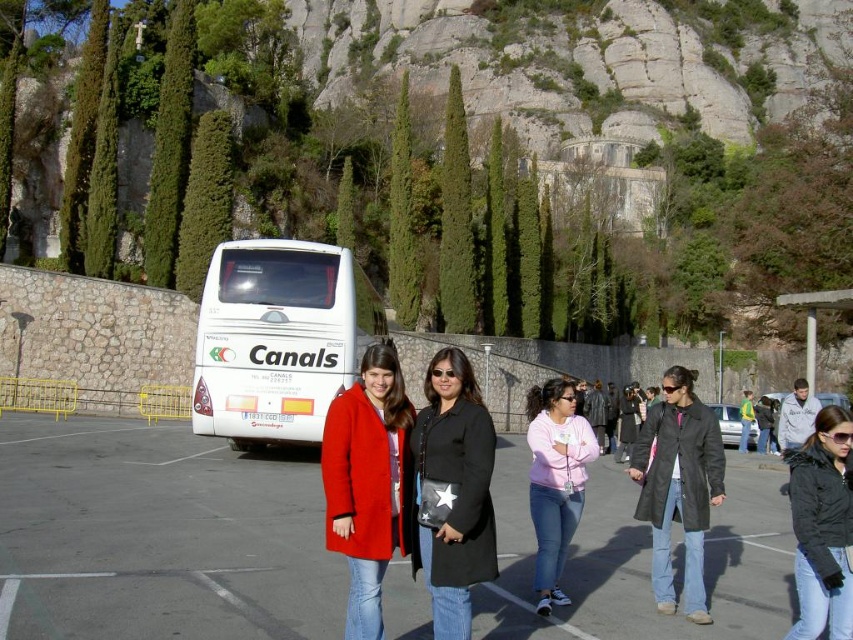
Is white glossy bus at upper left in front of matte red coat at center?

Yes, it is.

Between point (726, 508) and point (346, 420), which one is positioned behind?

Point (726, 508)

What are the coordinates of `white glossy bus at upper left` in the screenshot? It's located at (158, 536).

Between white glossy bus at upper left and white matte bus at left, which one is positioned lower?

white glossy bus at upper left is below.

This screenshot has width=853, height=640. I want to click on white glossy bus at upper left, so click(x=158, y=536).

You are a GUI agent. You are given a task and a screenshot of the screen. Output one action in this format:
    pyautogui.click(x=<x>, y=<y>)
    Task: Click on the white glossy bus at upper left
    The height and width of the screenshot is (640, 853).
    Given the screenshot: What is the action you would take?
    pyautogui.click(x=158, y=536)

Who is positioned more to the left, white matte bus at left or matte red coat at center?

From the viewer's perspective, white matte bus at left appears more on the left side.

Can you confirm if white matte bus at left is shorter than matte red coat at center?

Incorrect, white matte bus at left's height does not fall short of matte red coat at center's.

What do you see at coordinates (277, 339) in the screenshot? The image size is (853, 640). I see `white matte bus at left` at bounding box center [277, 339].

Where is `white matte bus at left`? white matte bus at left is located at coordinates (277, 339).